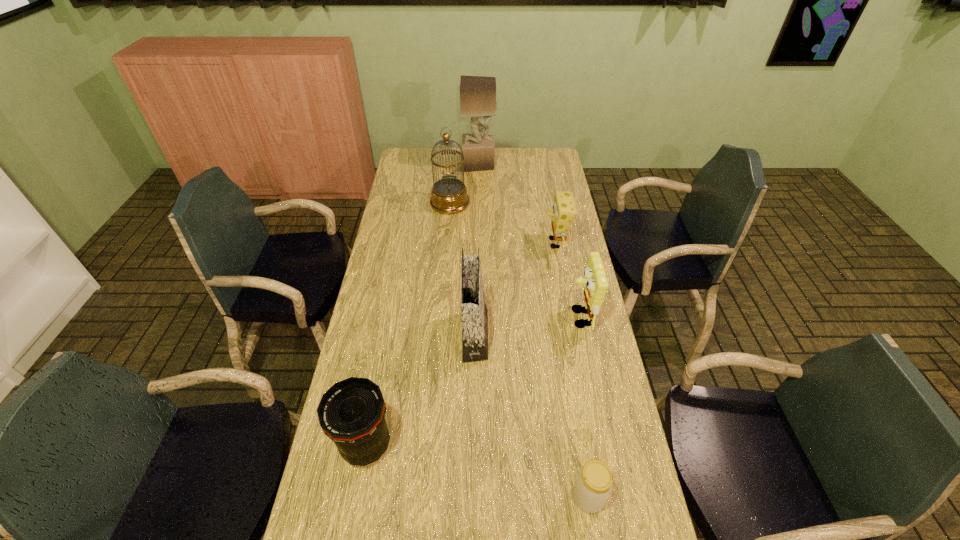
Where is `blank space located 0.400m with an open door on the second farthest object`? blank space located 0.400m with an open door on the second farthest object is located at coordinates pos(444,280).

Where is `free location located 0.360m on the front of the shopping bag with the design`? This screenshot has width=960, height=540. free location located 0.360m on the front of the shopping bag with the design is located at coordinates (596, 335).

Locate an element on the screen. free space located 0.120m on the face of the nearer sponge is located at coordinates (533, 318).

At what (x,y) coordinates should I click in order to perform the action: click on blank area located on the face of the nearer sponge. Please return your answer as a coordinate pair (x, y). Image resolution: width=960 pixels, height=540 pixels. Looking at the image, I should click on (539, 318).

You are a GUI agent. You are given a task and a screenshot of the screen. Output one action in this format:
    pyautogui.click(x=<x>, y=<y>)
    Task: Click on the vacant space located 0.230m on the face of the nearer sponge
    
    Given the screenshot: What is the action you would take?
    pyautogui.click(x=500, y=318)

This screenshot has height=540, width=960. Identify the location of blank area located 0.330m on the face of the farther sponge. (462, 244).

The height and width of the screenshot is (540, 960). Identify the location of vacant space located on the face of the farther sponge. (447, 244).

Identify the location of free space located 0.220m on the face of the farther sponge. (489, 244).

Identify the location of vacant space located 0.280m on the right of the telephoto lens. (498, 446).

Where is `vacant region located 0.210m on the left of the shortest object`? vacant region located 0.210m on the left of the shortest object is located at coordinates pyautogui.click(x=488, y=497).